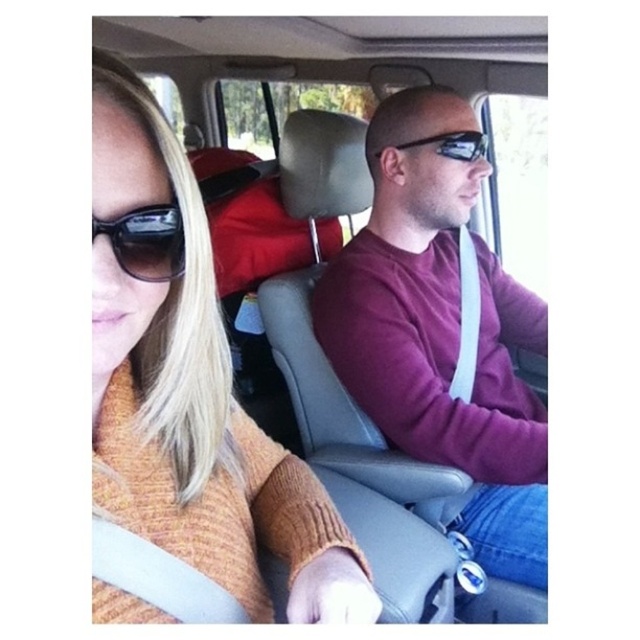
Question: Among these objects, which one is farthest from the camera?

Choices:
 (A) shiny black sunglasses at center
 (B) red fabric seat at center
 (C) orange knitted sweater at left

Answer: (B)

Question: Does orange knitted sweater at left appear over red fabric seat at center?

Choices:
 (A) no
 (B) yes

Answer: (A)

Question: Which object is positioned closest to the red fabric seat at center?

Choices:
 (A) shiny black sunglasses at center
 (B) matte black sunglasses at upper left
 (C) maroon sweater at center
 (D) orange knitted sweater at left

Answer: (C)

Question: Does maroon sweater at center have a greater width compared to shiny black sunglasses at center?

Choices:
 (A) no
 (B) yes

Answer: (B)

Question: Can you confirm if maroon sweater at center is bigger than shiny black sunglasses at center?

Choices:
 (A) yes
 (B) no

Answer: (A)

Question: Which object is farther from the camera taking this photo?

Choices:
 (A) maroon sweater at center
 (B) shiny black sunglasses at center
 (C) orange knitted sweater at left

Answer: (B)